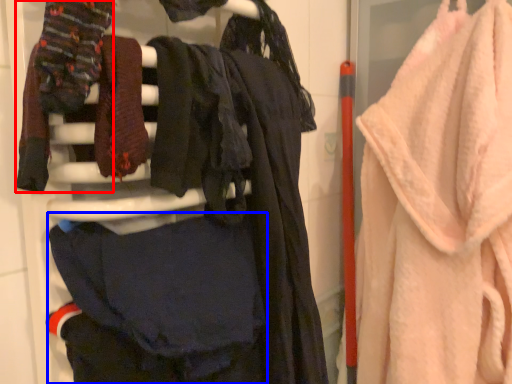
Question: Which object is further to the camera taking this photo, clothing (highlighted by a red box) or clothing (highlighted by a blue box)?

Choices:
 (A) clothing
 (B) clothing

Answer: (B)